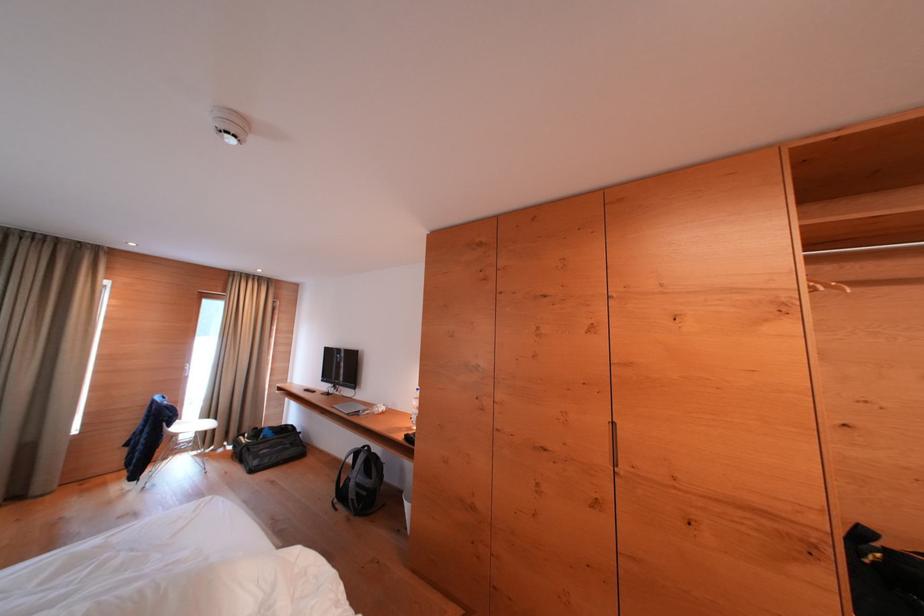
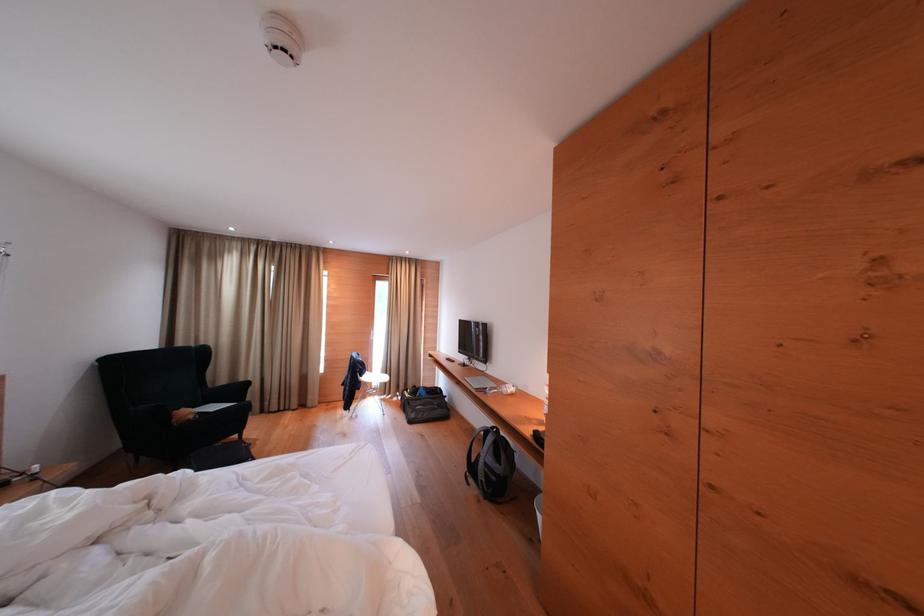
Find the pixel in the second image that matches (371,415) in the first image.

(499, 392)